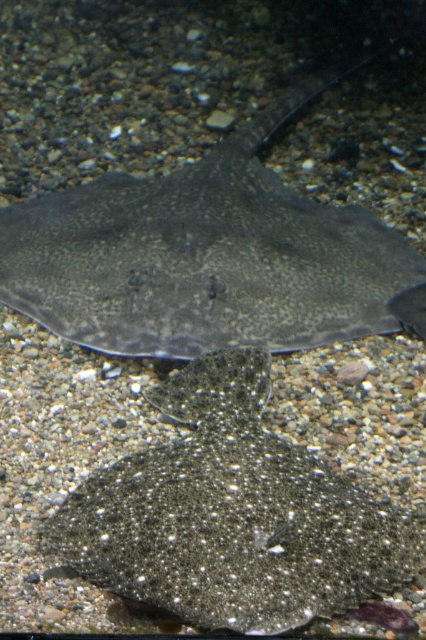
You are a marine biologist observing the marine environment. You notice the dark gray textured stingray at center and the speckled matte flatfish at center. Which one is closer to the camera?

The dark gray textured stingray at center is closer to the camera because the speckled matte flatfish at center is behind it.

From the picture: You are an underwater photographer aiming to capture both the dark gray textured stingray at center and the speckled matte flatfish at center in a single frame. Based on their positions, which one do you need to adjust your camera angle closer to in order to include both subjects without cropping?

The dark gray textured stingray at center might be wider than the speckled matte flatfish at center, so you might need to adjust your camera angle closer to the speckled matte flatfish at center to ensure both fit in the frame without cropping.